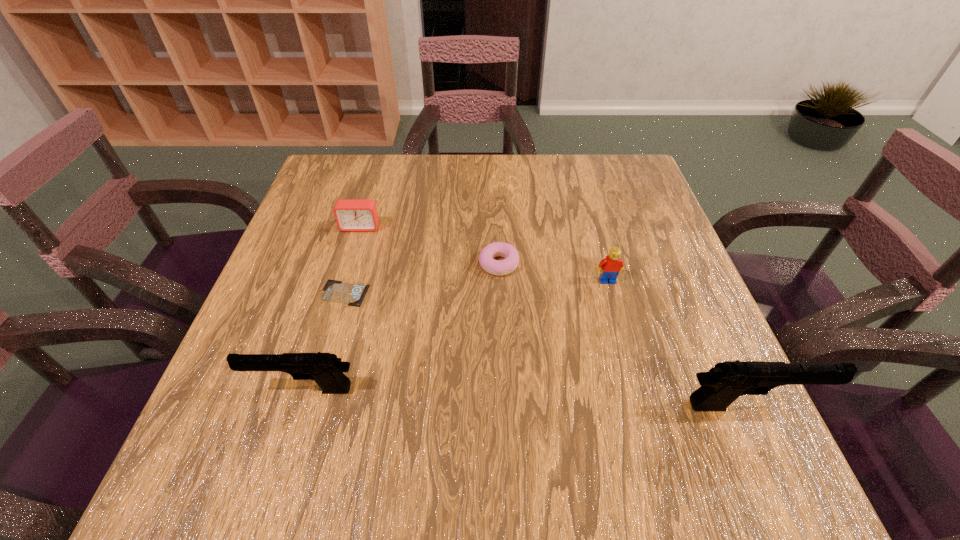
Image resolution: width=960 pixels, height=540 pixels. What are the coordinates of `free space that satisfies the following two spatial constraints: 1. on the front-facing side of the alarm clock; 2. on the front-facing side of the fifth farthest object` in the screenshot? It's located at (312, 389).

Where is `free space that satisfies the following two spatial constraints: 1. on the front-facing side of the farthest object; 2. on the front-facing side of the left pistol`? free space that satisfies the following two spatial constraints: 1. on the front-facing side of the farthest object; 2. on the front-facing side of the left pistol is located at coordinates (312, 389).

Image resolution: width=960 pixels, height=540 pixels. I want to click on vacant space that satisfies the following two spatial constraints: 1. on the front-facing side of the farthest object; 2. on the front-facing side of the left pistol, so click(312, 389).